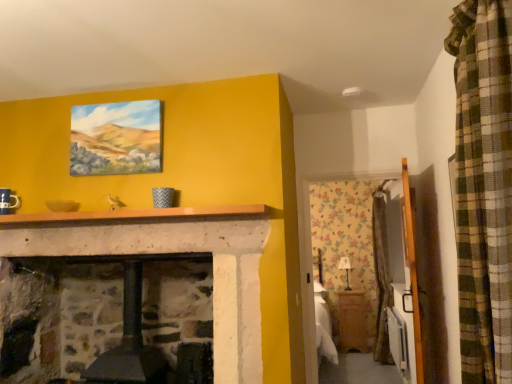
Where is `free space above matte canvas painting at upper center (from a real-world perspective)`? The height and width of the screenshot is (384, 512). free space above matte canvas painting at upper center (from a real-world perspective) is located at coordinates (113, 96).